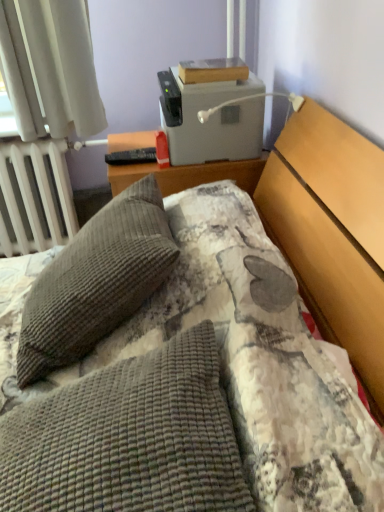
Question: Could you tell me if gray corduroy pillow at left, acting as the second pillow starting from the front, is turned towards white plastic lamp at upper right?

Choices:
 (A) no
 (B) yes

Answer: (A)

Question: Is gray corduroy pillow at left, which appears as the first pillow when viewed from the back, next to white plastic lamp at upper right?

Choices:
 (A) yes
 (B) no

Answer: (B)

Question: Can you confirm if gray corduroy pillow at left, which appears as the first pillow when viewed from the back, is thinner than white plastic lamp at upper right?

Choices:
 (A) no
 (B) yes

Answer: (B)

Question: From the image's perspective, is gray corduroy pillow at left, acting as the second pillow starting from the front, below white plastic lamp at upper right?

Choices:
 (A) no
 (B) yes

Answer: (B)

Question: Can you confirm if gray corduroy pillow at left, acting as the second pillow starting from the front, is taller than white plastic lamp at upper right?

Choices:
 (A) no
 (B) yes

Answer: (B)

Question: Is gray corduroy pillow at left, which appears as the first pillow when viewed from the back, wider than white plastic lamp at upper right?

Choices:
 (A) no
 (B) yes

Answer: (A)

Question: From a real-world perspective, is white plastic lamp at upper right physically above gray plastic printer at upper center?

Choices:
 (A) yes
 (B) no

Answer: (A)

Question: Is white plastic lamp at upper right touching gray plastic printer at upper center?

Choices:
 (A) yes
 (B) no

Answer: (A)

Question: Does white plastic lamp at upper right turn towards gray plastic printer at upper center?

Choices:
 (A) yes
 (B) no

Answer: (B)

Question: Could gray plastic printer at upper center be considered to be inside white plastic lamp at upper right?

Choices:
 (A) yes
 (B) no

Answer: (B)

Question: Does white plastic lamp at upper right come in front of gray plastic printer at upper center?

Choices:
 (A) no
 (B) yes

Answer: (B)

Question: From the image's perspective, is white plastic lamp at upper right located beneath gray plastic printer at upper center?

Choices:
 (A) no
 (B) yes

Answer: (B)

Question: Is gray corduroy pillow at left, which appears as the first pillow when viewed from the back, positioned in front of gray plastic printer at upper center?

Choices:
 (A) no
 (B) yes

Answer: (B)